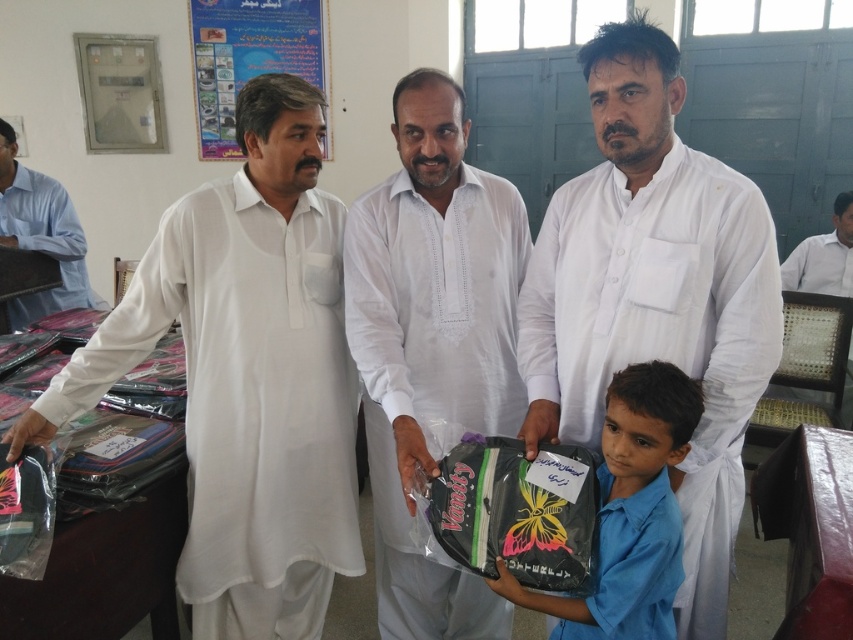
Question: Estimate the real-world distances between objects in this image. Which object is closer to the light blue shirt at left?

Choices:
 (A) white cotton shirt at center
 (B) matte black backpack at center
 (C) white cotton shirt at left

Answer: (C)

Question: Can you confirm if matte black backpack at center is positioned to the right of light blue shirt at left?

Choices:
 (A) no
 (B) yes

Answer: (B)

Question: Can you confirm if light blue shirt at left is positioned above white cotton shirt at upper right?

Choices:
 (A) no
 (B) yes

Answer: (B)

Question: Estimate the real-world distances between objects in this image. Which object is closer to the white matte shirt at center?

Choices:
 (A) white cotton shirt at upper right
 (B) white cotton shirt at center
 (C) light blue shirt at left

Answer: (B)

Question: Which point is farther to the camera?

Choices:
 (A) white cotton shirt at upper right
 (B) white cotton shirt at left
 (C) matte black backpack at center
 (D) white matte shirt at center

Answer: (A)

Question: Is white cotton shirt at left to the right of white cotton shirt at center from the viewer's perspective?

Choices:
 (A) yes
 (B) no

Answer: (B)